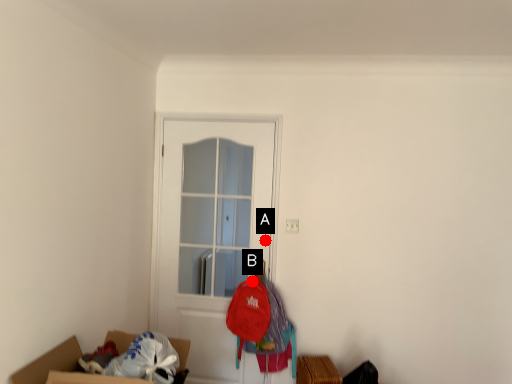
Question: Two points are circled on the image, labeled by A and B beside each circle. Which point is further to the camera?

Choices:
 (A) A is further
 (B) B is further

Answer: (A)